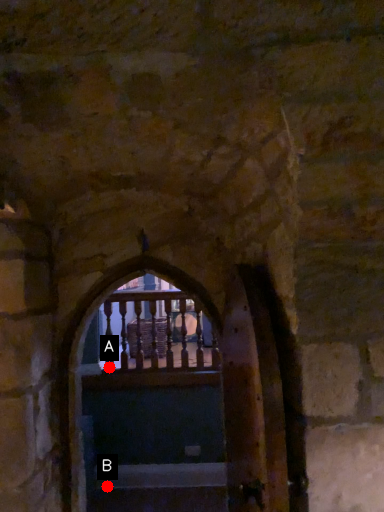
Question: Two points are circled on the image, labeled by A and B beside each circle. Which point is further to the camera?

Choices:
 (A) A is further
 (B) B is further

Answer: (A)